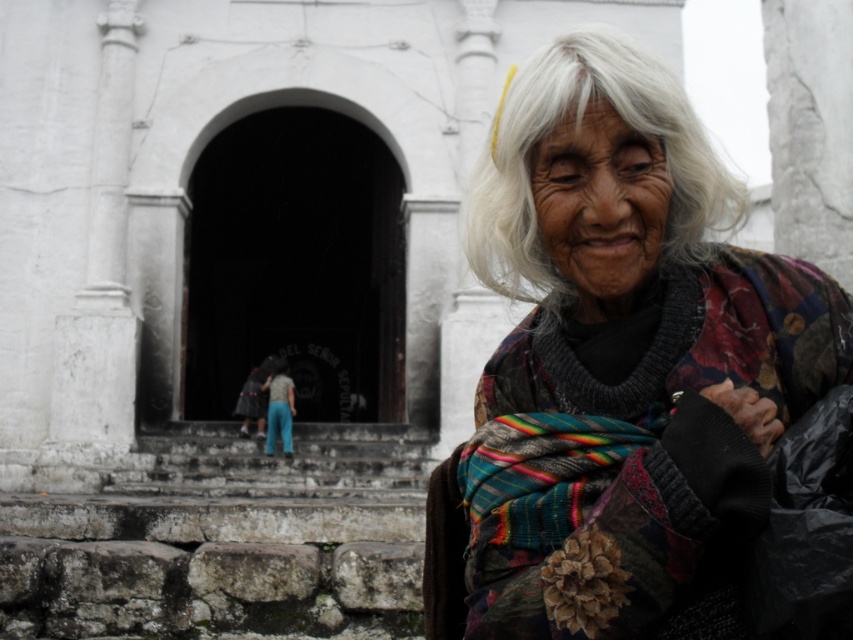
Question: Which object is closer to the camera taking this photo?

Choices:
 (A) white silky hair at center
 (B) white stone wall at upper right
 (C) multicolored woven shawl at center

Answer: (C)

Question: Is stone steps at lower left to the left of white silky hair at center from the viewer's perspective?

Choices:
 (A) no
 (B) yes

Answer: (B)

Question: Can you confirm if multicolored woven shawl at center is smaller than white stone wall at upper right?

Choices:
 (A) yes
 (B) no

Answer: (B)

Question: Among these points, which one is nearest to the camera?

Choices:
 (A) (645, 54)
 (B) (39, 554)
 (C) (606, 472)
 (D) (770, 120)

Answer: (C)

Question: Among these points, which one is farthest from the camera?

Choices:
 (A) (62, 468)
 (B) (498, 595)
 (C) (669, 104)
 (D) (833, 144)

Answer: (A)

Question: Observing the image, what is the correct spatial positioning of multicolored woven shawl at center in reference to white silky hair at center?

Choices:
 (A) right
 (B) left

Answer: (B)